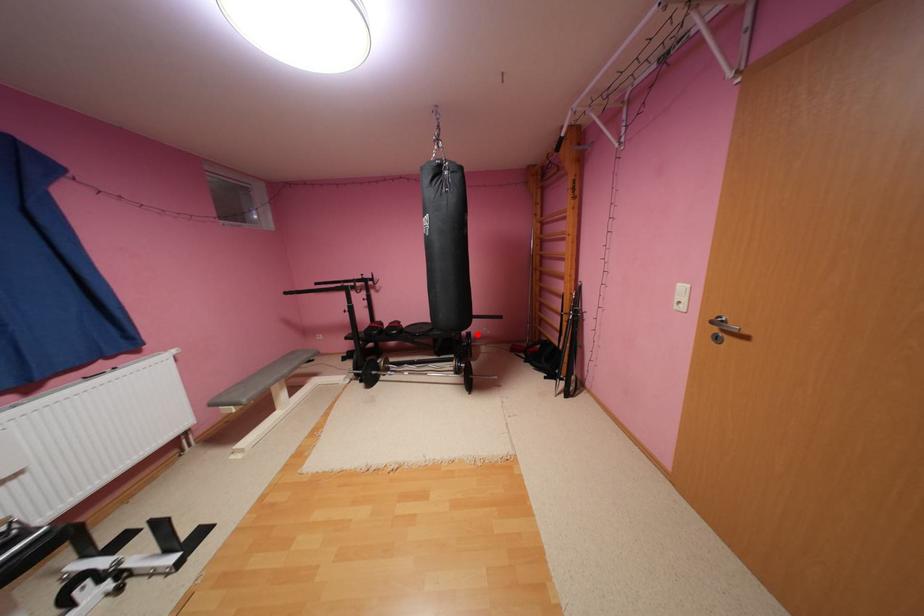
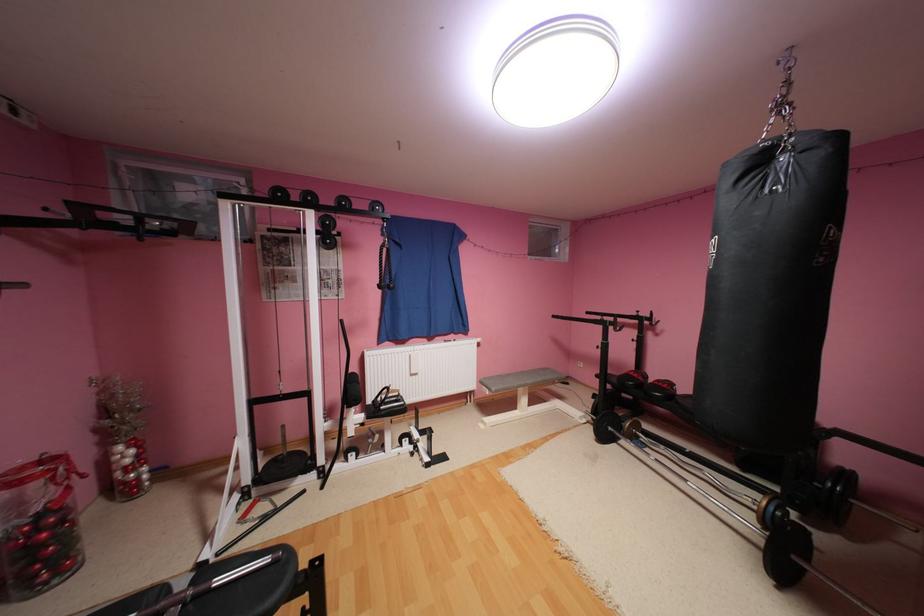
In the second image, find the point that corresponds to the highlighted location in the first image.

(857, 475)